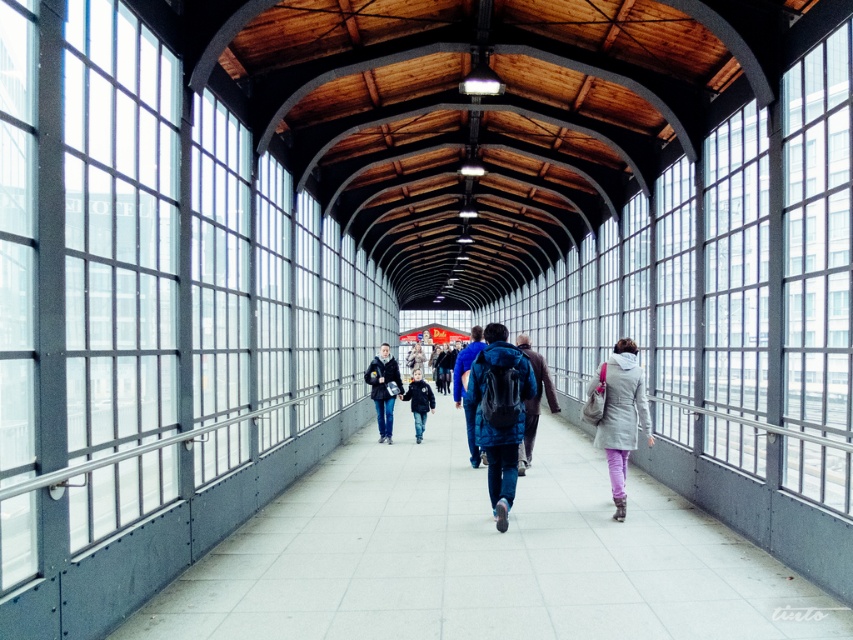
Between blue matte backpack at center and blue fabric backpack at center, which one appears on the left side from the viewer's perspective?

blue fabric backpack at center

Can you confirm if blue matte backpack at center is bigger than blue fabric backpack at center?

No, blue matte backpack at center is not bigger than blue fabric backpack at center.

Locate an element on the screen. The height and width of the screenshot is (640, 853). blue matte backpack at center is located at coordinates (498, 412).

Is smooth concrete walkway at center behind light blue denim jacket at center?

No, smooth concrete walkway at center is in front of light blue denim jacket at center.

This screenshot has width=853, height=640. Identify the location of smooth concrete walkway at center. (482, 556).

Where is `smooth concrete walkway at center`? smooth concrete walkway at center is located at coordinates (482, 556).

Can you confirm if blue matte backpack at center is wider than matte black jacket at center?

No.

Is point (491, 355) positioned after point (386, 378)?

No, (491, 355) is closer to viewer.

The width and height of the screenshot is (853, 640). Identify the location of blue matte backpack at center. (498, 412).